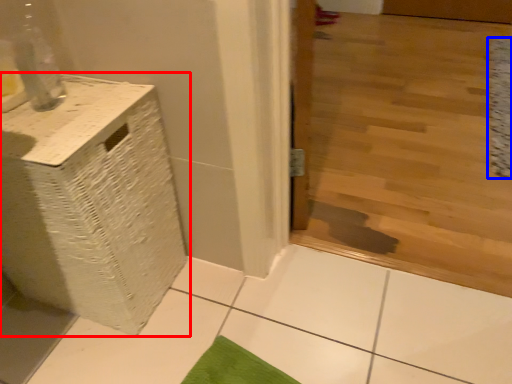
Question: Which of the following is the closest to the observer, furniture (highlighted by a red box) or mat (highlighted by a blue box)?

Choices:
 (A) furniture
 (B) mat

Answer: (A)